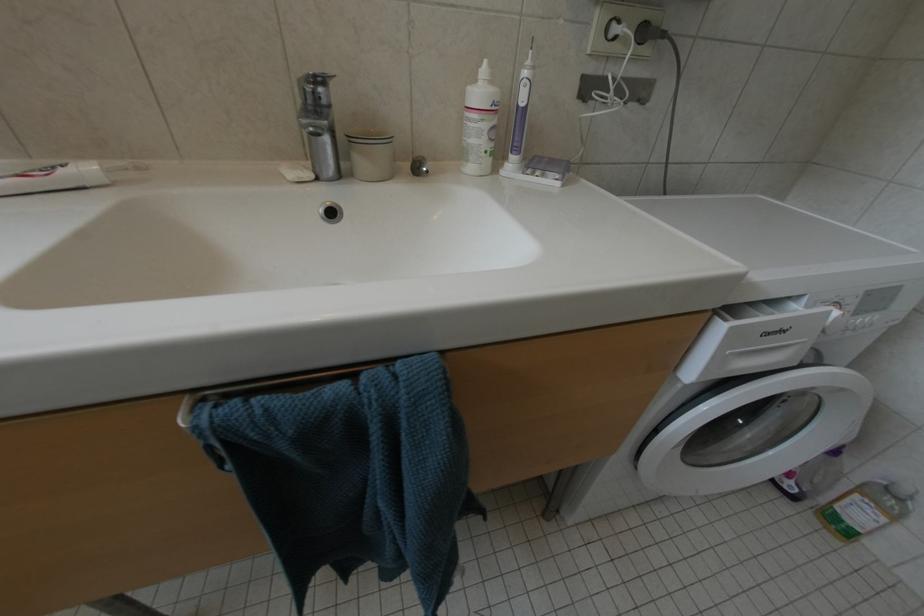
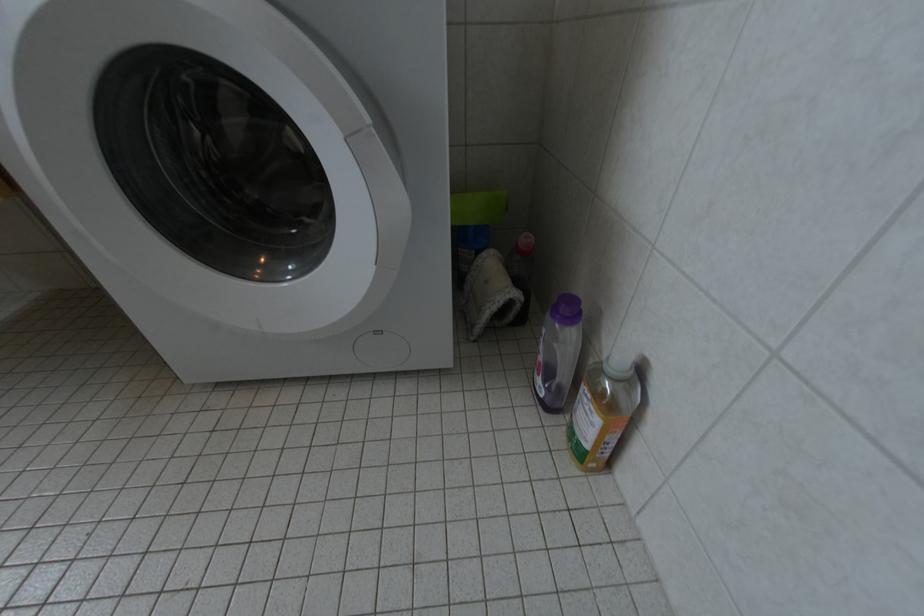
In a continuous first-person perspective shot, in which direction is the camera moving?

The cameraman moved toward right, forward.